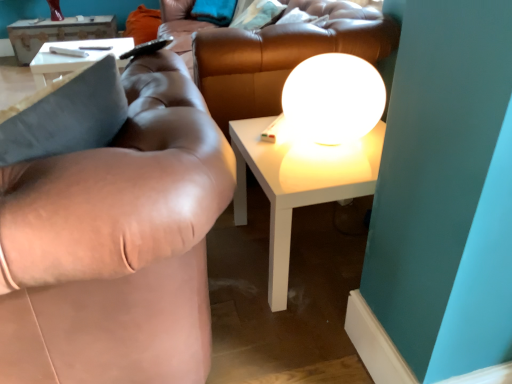
Question: From a real-world perspective, does white glossy sphere at upper center sit lower than white glossy table at center, positioned as the 2th table in back-to-front order?

Choices:
 (A) yes
 (B) no

Answer: (B)

Question: Can you confirm if white glossy sphere at upper center is shorter than white glossy table at center, the first table in the right-to-left sequence?

Choices:
 (A) yes
 (B) no

Answer: (A)

Question: Can you confirm if white glossy sphere at upper center is positioned to the left of white glossy table at center, the first table from the front?

Choices:
 (A) no
 (B) yes

Answer: (A)

Question: From a real-world perspective, is white glossy sphere at upper center on white glossy table at center, the second table when ordered from left to right?

Choices:
 (A) no
 (B) yes

Answer: (B)

Question: Does white glossy sphere at upper center have a lesser width compared to white glossy table at center, the second table when ordered from left to right?

Choices:
 (A) yes
 (B) no

Answer: (A)

Question: Is white glossy sphere at upper center to the left or to the right of soft teal pillow at upper center, arranged as the second pillow when viewed from the left, in the image?

Choices:
 (A) left
 (B) right

Answer: (B)

Question: In terms of width, does white glossy sphere at upper center look wider or thinner when compared to soft teal pillow at upper center, arranged as the second pillow when viewed from the left?

Choices:
 (A) wide
 (B) thin

Answer: (A)

Question: Looking at the image, does white glossy sphere at upper center seem bigger or smaller compared to soft teal pillow at upper center, the 1th pillow from the right?

Choices:
 (A) big
 (B) small

Answer: (B)

Question: From the image's perspective, is white glossy sphere at upper center positioned above or below soft teal pillow at upper center, the 1th pillow from the right?

Choices:
 (A) below
 (B) above

Answer: (A)

Question: Is brown leather couch at left inside or outside of brown leather couch at center?

Choices:
 (A) outside
 (B) inside

Answer: (A)

Question: From the image's perspective, relative to brown leather couch at center, is brown leather couch at left above or below?

Choices:
 (A) above
 (B) below

Answer: (B)

Question: In terms of height, does brown leather couch at left look taller or shorter compared to brown leather couch at center?

Choices:
 (A) short
 (B) tall

Answer: (A)

Question: Considering the positions of brown leather couch at left and brown leather couch at center in the image, is brown leather couch at left bigger or smaller than brown leather couch at center?

Choices:
 (A) small
 (B) big

Answer: (A)

Question: Is brown leather couch at center taller or shorter than brown leather couch at left?

Choices:
 (A) short
 (B) tall

Answer: (B)

Question: Visually, is brown leather couch at center positioned to the left or to the right of brown leather couch at left?

Choices:
 (A) right
 (B) left

Answer: (A)